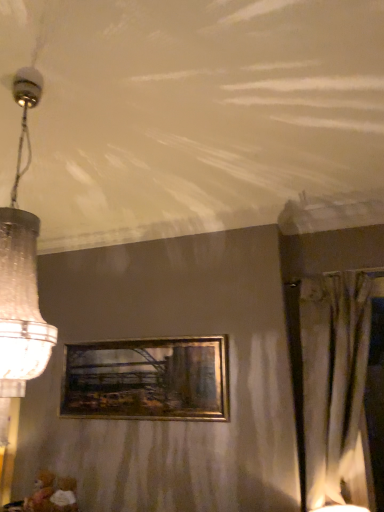
The width and height of the screenshot is (384, 512). What do you see at coordinates (21, 270) in the screenshot? I see `clear glass chandelier at left` at bounding box center [21, 270].

Where is `gold metallic picture frame at center`? Image resolution: width=384 pixels, height=512 pixels. gold metallic picture frame at center is located at coordinates (147, 380).

Describe the element at coordinates (147, 380) in the screenshot. I see `gold metallic picture frame at center` at that location.

This screenshot has height=512, width=384. Identify the location of silky beige curtain at right. (333, 377).

Find the location of a particular element. The image size is (384, 512). clear glass chandelier at left is located at coordinates (21, 270).

Between silky beige curtain at right and gold metallic picture frame at center, which one has larger width?

silky beige curtain at right.

Who is bigger, silky beige curtain at right or gold metallic picture frame at center?

silky beige curtain at right is bigger.

Which of these two, silky beige curtain at right or gold metallic picture frame at center, stands shorter?

Standing shorter between the two is gold metallic picture frame at center.

Can you confirm if gold metallic picture frame at center is taller than clear glass chandelier at left?

No, gold metallic picture frame at center is not taller than clear glass chandelier at left.

How far apart are gold metallic picture frame at center and clear glass chandelier at left?

gold metallic picture frame at center and clear glass chandelier at left are 4.28 feet apart from each other.

From the image's perspective, which object appears higher, gold metallic picture frame at center or clear glass chandelier at left?

clear glass chandelier at left, from the image's perspective.

Considering the positions of point (143, 360) and point (13, 220), is point (143, 360) closer or farther from the camera than point (13, 220)?

Clearly, point (143, 360) is more distant from the camera than point (13, 220).

Is gold metallic picture frame at center turned away from silky beige curtain at right?

gold metallic picture frame at center is not turned away from silky beige curtain at right.

Considering the relative sizes of gold metallic picture frame at center and silky beige curtain at right in the image provided, is gold metallic picture frame at center taller than silky beige curtain at right?

In fact, gold metallic picture frame at center may be shorter than silky beige curtain at right.

What's the angular difference between gold metallic picture frame at center and silky beige curtain at right's facing directions?

The angular difference between gold metallic picture frame at center and silky beige curtain at right is 0.004 degrees.

Can you confirm if gold metallic picture frame at center is thinner than silky beige curtain at right?

Correct, the width of gold metallic picture frame at center is less than that of silky beige curtain at right.

Relative to gold metallic picture frame at center, is clear glass chandelier at left in front or behind?

Clearly, clear glass chandelier at left is in front of gold metallic picture frame at center.

Find the location of a particular element. Image resolution: width=384 pixels, height=512 pixels. picture frame below the clear glass chandelier at left (from the image's perspective) is located at coordinates (147, 380).

From the image's perspective, which is below, clear glass chandelier at left or gold metallic picture frame at center?

gold metallic picture frame at center is shown below in the image.

From their relative heights in the image, would you say clear glass chandelier at left is taller or shorter than gold metallic picture frame at center?

Clearly, clear glass chandelier at left is taller compared to gold metallic picture frame at center.

From the image's perspective, is clear glass chandelier at left located above silky beige curtain at right?

Yes, from the image's perspective, clear glass chandelier at left is above silky beige curtain at right.

The width and height of the screenshot is (384, 512). What are the coordinates of `curtain behind the clear glass chandelier at left` in the screenshot? It's located at (333, 377).

Considering the sizes of objects clear glass chandelier at left and silky beige curtain at right in the image provided, who is shorter, clear glass chandelier at left or silky beige curtain at right?

clear glass chandelier at left.

Is silky beige curtain at right at the back of clear glass chandelier at left?

No.

Does silky beige curtain at right have a smaller size compared to clear glass chandelier at left?

Indeed, silky beige curtain at right has a smaller size compared to clear glass chandelier at left.

Is silky beige curtain at right in contact with clear glass chandelier at left?

No, silky beige curtain at right is not beside clear glass chandelier at left.

Is silky beige curtain at right in front of clear glass chandelier at left?

No, silky beige curtain at right is further to the viewer.

Can you tell me how much silky beige curtain at right and clear glass chandelier at left differ in facing direction?

The angle between the facing direction of silky beige curtain at right and the facing direction of clear glass chandelier at left is 1.7 degrees.

The height and width of the screenshot is (512, 384). Identify the location of curtain on the right of gold metallic picture frame at center. pos(333,377).

This screenshot has width=384, height=512. I want to click on picture frame below the clear glass chandelier at left (from a real-world perspective), so click(147, 380).

Based on their spatial positions, is clear glass chandelier at left or silky beige curtain at right further from gold metallic picture frame at center?

The object further to gold metallic picture frame at center is clear glass chandelier at left.

From the picture: Which object lies further to the anchor point clear glass chandelier at left, gold metallic picture frame at center or silky beige curtain at right?

silky beige curtain at right is positioned further to the anchor clear glass chandelier at left.

Which object lies further to the anchor point gold metallic picture frame at center, silky beige curtain at right or clear glass chandelier at left?

Based on the image, clear glass chandelier at left appears to be further to gold metallic picture frame at center.

When comparing their distances from silky beige curtain at right, does clear glass chandelier at left or gold metallic picture frame at center seem further?

Based on the image, clear glass chandelier at left appears to be further to silky beige curtain at right.

Which object lies nearer to the anchor point clear glass chandelier at left, silky beige curtain at right or gold metallic picture frame at center?

gold metallic picture frame at center is closer to clear glass chandelier at left.

Looking at the image, which one is located further to silky beige curtain at right, gold metallic picture frame at center or clear glass chandelier at left?

Based on the image, clear glass chandelier at left appears to be further to silky beige curtain at right.

At what (x,y) coordinates should I click in order to perform the action: click on picture frame between clear glass chandelier at left and silky beige curtain at right. Please return your answer as a coordinate pair (x, y). Looking at the image, I should click on (147, 380).